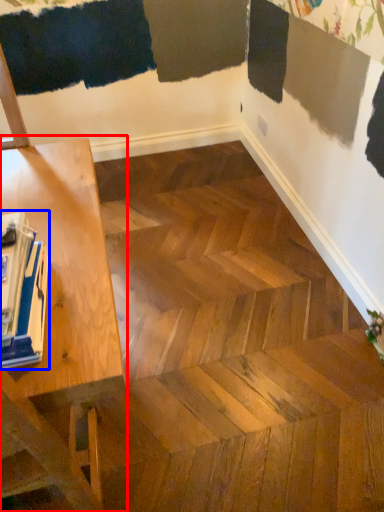
Question: Among these objects, which one is farthest to the camera, table (highlighted by a red box) or magazine (highlighted by a blue box)?

Choices:
 (A) table
 (B) magazine

Answer: (B)